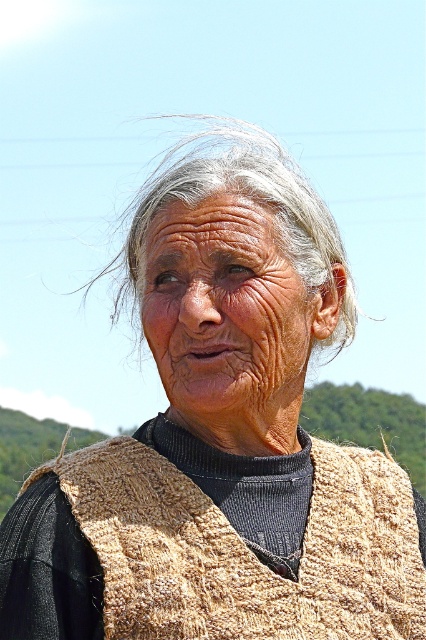
Question: Is knitted beige shawl at center below gray woolen hair at center?

Choices:
 (A) yes
 (B) no

Answer: (A)

Question: Is knitted beige shawl at center closer to the viewer compared to gray woolen hair at center?

Choices:
 (A) no
 (B) yes

Answer: (B)

Question: Which object appears farthest from the camera in this image?

Choices:
 (A) gray woolen hair at center
 (B) dry skin at center
 (C) knitted beige shawl at center

Answer: (A)

Question: Which of these objects is positioned closest to the dry skin at center?

Choices:
 (A) gray woolen hair at center
 (B) knitted beige shawl at center

Answer: (B)

Question: Estimate the real-world distances between objects in this image. Which object is closer to the dry skin at center?

Choices:
 (A) gray woolen hair at center
 (B) knitted beige shawl at center

Answer: (B)

Question: Is the position of dry skin at center less distant than that of gray woolen hair at center?

Choices:
 (A) yes
 (B) no

Answer: (A)